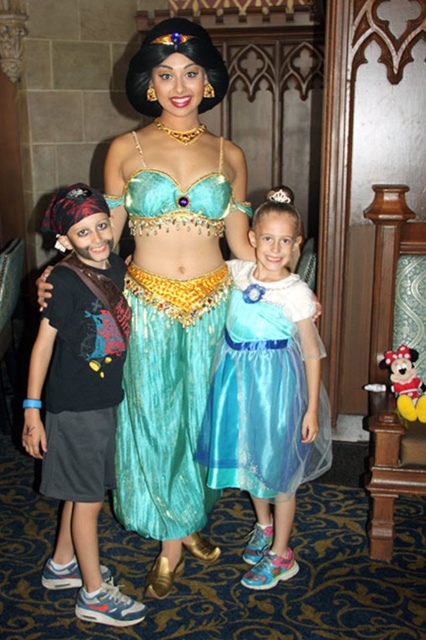
You are a photographer at a themed event and need to capture a photo of the shiny teal dress at center and the shiny blue dress at center. According to the scene description, which dress is positioned higher in the image?

The shiny teal dress at center is positioned higher in the image than the shiny blue dress at center.

You are standing in front of the image and see the point marked at coordinates (267,394). Which object in the scene does this point lie on?

The point at coordinates (267,394) lies on the shiny blue dress at center.

You are a photographer at a themed event. You need to position two princesses, the shiny teal dress at center and the shiny blue dress at center, so that they are visible in the photo. Given their heights, which princess should stand closer to the front to ensure both are visible?

The shiny teal dress at center is much taller than the shiny blue dress at center, so the taller princess should stand closer to the front to ensure both are visible.